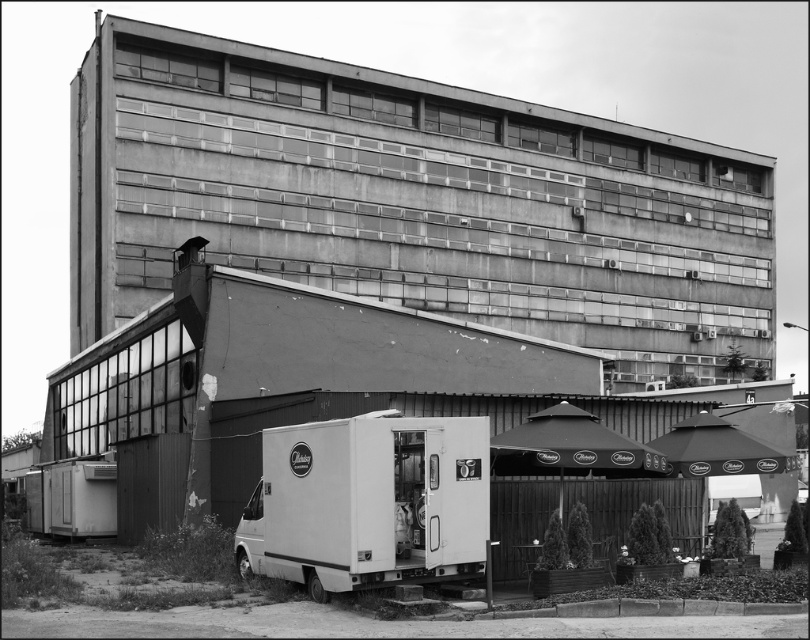
How distant is white matte food truck at lower center from metallic trailer at lower left?

white matte food truck at lower center is 77.63 feet from metallic trailer at lower left.

Is point (314, 596) more distant than point (77, 484)?

No, it is not.

Does point (365, 536) come behind point (58, 464)?

No, (365, 536) is closer to viewer.

In order to click on white matte food truck at lower center in this screenshot , I will do `click(369, 502)`.